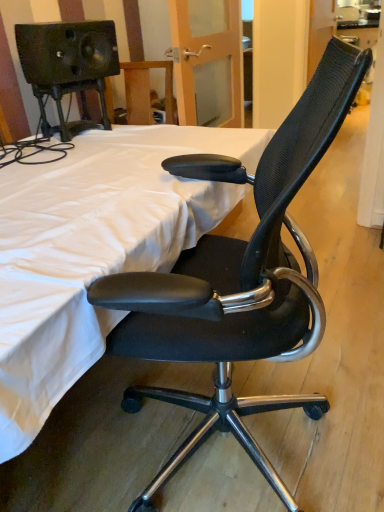
Question: Is white fabric bed at center at the right side of black mesh office chair at center?

Choices:
 (A) yes
 (B) no

Answer: (B)

Question: Is white fabric bed at center shorter than black mesh office chair at center?

Choices:
 (A) no
 (B) yes

Answer: (B)

Question: From the image's perspective, does white fabric bed at center appear higher than black mesh office chair at center?

Choices:
 (A) no
 (B) yes

Answer: (B)

Question: From the image's perspective, is white fabric bed at center beneath black mesh office chair at center?

Choices:
 (A) yes
 (B) no

Answer: (B)

Question: Is white fabric bed at center positioned before black mesh office chair at center?

Choices:
 (A) yes
 (B) no

Answer: (B)

Question: Is white fabric bed at center aimed at black mesh office chair at center?

Choices:
 (A) yes
 (B) no

Answer: (A)

Question: Can you confirm if black mesh office chair at center is bigger than white fabric bed at center?

Choices:
 (A) no
 (B) yes

Answer: (A)

Question: Is black mesh office chair at center taller than white fabric bed at center?

Choices:
 (A) yes
 (B) no

Answer: (A)

Question: Is black mesh office chair at center positioned beyond the bounds of white fabric bed at center?

Choices:
 (A) yes
 (B) no

Answer: (A)

Question: Can you confirm if black mesh office chair at center is smaller than white fabric bed at center?

Choices:
 (A) no
 (B) yes

Answer: (B)

Question: From the image's perspective, does black mesh office chair at center appear higher than white fabric bed at center?

Choices:
 (A) yes
 (B) no

Answer: (B)

Question: Is white fabric bed at center completely or partially inside black mesh office chair at center?

Choices:
 (A) yes
 (B) no

Answer: (B)

Question: From their relative heights in the image, would you say white fabric bed at center is taller or shorter than black mesh office chair at center?

Choices:
 (A) short
 (B) tall

Answer: (A)